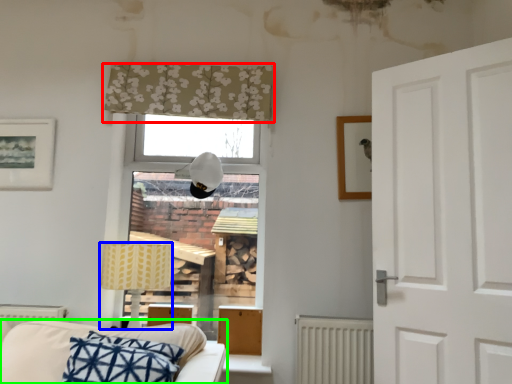
Question: Based on their relative distances, which object is farther from curtain (highlighted by a red box)? Choose from table lamp (highlighted by a blue box) and studio couch (highlighted by a green box).

Choices:
 (A) table lamp
 (B) studio couch

Answer: (B)